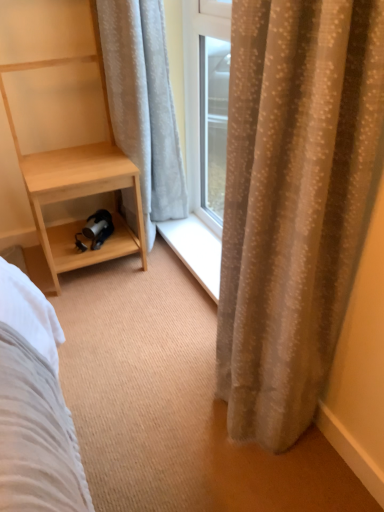
Describe the element at coordinates (294, 202) in the screenshot. The image size is (384, 512). I see `beige textured curtain at right, positioned as the 1th curtain in right-to-left order` at that location.

In order to face light wood/texture shelf at left, should I rotate leftwards or rightwards?

A 15.988 degree turn to the left will do.

What is the approximate width of light wood/texture shelf at left?

17.54 inches.

How much space does white textured curtain at left, the 2th curtain when ordered from right to left, occupy horizontally?

The width of white textured curtain at left, the 2th curtain when ordered from right to left, is 7.62 inches.

Describe the element at coordinates (143, 104) in the screenshot. I see `white textured curtain at left, the 2th curtain when ordered from right to left` at that location.

Where is `beige textured curtain at right, positioned as the 1th curtain in front-to-back order`? The image size is (384, 512). beige textured curtain at right, positioned as the 1th curtain in front-to-back order is located at coordinates (294, 202).

Considering the positions of point (101, 3) and point (75, 186), is point (101, 3) closer or farther from the camera than point (75, 186)?

Point (101, 3) is positioned farther from the camera compared to point (75, 186).

Between white textured curtain at left, the 2th curtain when ordered from right to left, and light wood/texture shelf at left, which one appears on the left side from the viewer's perspective?

From the viewer's perspective, light wood/texture shelf at left appears more on the left side.

Identify the location of shelf below the white textured curtain at left, the 1th curtain when ordered from left to right (from a real-world perspective). The width and height of the screenshot is (384, 512). (62, 136).

Is light wood/texture shelf at left next to white textured curtain at left, the 2th curtain when ordered from right to left?

No, light wood/texture shelf at left is not touching white textured curtain at left, the 2th curtain when ordered from right to left.

At what (x,y) coordinates should I click in order to perform the action: click on curtain behind the light wood/texture shelf at left. Please return your answer as a coordinate pair (x, y). The width and height of the screenshot is (384, 512). Looking at the image, I should click on (143, 104).

Can you tell me how much light wood/texture shelf at left and white textured curtain at left, marked as the first curtain in a back-to-front arrangement, differ in facing direction?

The angular difference between light wood/texture shelf at left and white textured curtain at left, marked as the first curtain in a back-to-front arrangement, is 88 degrees.

Considering the sizes of objects light wood/texture shelf at left and white textured curtain at left, the 2th curtain when ordered from right to left, in the image provided, who is wider, light wood/texture shelf at left or white textured curtain at left, the 2th curtain when ordered from right to left,?

Wider between the two is light wood/texture shelf at left.

From the image's perspective, is white textured curtain at left, acting as the 2th curtain starting from the front, on beige textured curtain at right, positioned as the 1th curtain in right-to-left order?

Indeed, from the image's perspective, white textured curtain at left, acting as the 2th curtain starting from the front, is shown above beige textured curtain at right, positioned as the 1th curtain in right-to-left order.

You are a GUI agent. You are given a task and a screenshot of the screen. Output one action in this format:
    pyautogui.click(x=<x>, y=<y>)
    Task: Click on the curtain that appears in front of the white textured curtain at left, the 1th curtain when ordered from left to right
    This screenshot has width=384, height=512.
    Given the screenshot: What is the action you would take?
    pyautogui.click(x=294, y=202)

Can you confirm if white textured curtain at left, acting as the 2th curtain starting from the front, is bigger than beige textured curtain at right, which is counted as the second curtain, starting from the back?

No.

Is the surface of beige textured curtain at right, positioned as the 1th curtain in right-to-left order, in direct contact with light wood/texture shelf at left?

They are not placed beside each other.

How different are the orientations of beige textured curtain at right, positioned as the 1th curtain in front-to-back order, and light wood/texture shelf at left in degrees?

The angle between the facing direction of beige textured curtain at right, positioned as the 1th curtain in front-to-back order, and the facing direction of light wood/texture shelf at left is 88 degrees.

Who is more distant, beige textured curtain at right, positioned as the 1th curtain in right-to-left order, or light wood/texture shelf at left?

light wood/texture shelf at left is more distant.

Looking at the image, does beige textured curtain at right, positioned as the 1th curtain in front-to-back order, seem bigger or smaller compared to light wood/texture shelf at left?

In the image, beige textured curtain at right, positioned as the 1th curtain in front-to-back order, appears to be smaller than light wood/texture shelf at left.

Is light wood/texture shelf at left facing away from beige textured curtain at right, acting as the 2th curtain starting from the left?

No.

At what (x,y) coordinates should I click in order to perform the action: click on shelf beneath the beige textured curtain at right, acting as the 2th curtain starting from the left (from a real-world perspective). Please return your answer as a coordinate pair (x, y). Looking at the image, I should click on pyautogui.click(x=62, y=136).

Which point is more distant from viewer, (92, 203) or (302, 9)?

Point (92, 203)

Who is smaller, beige textured curtain at right, positioned as the 1th curtain in front-to-back order, or white textured curtain at left, acting as the 2th curtain starting from the front?

With smaller size is white textured curtain at left, acting as the 2th curtain starting from the front.

The height and width of the screenshot is (512, 384). Identify the location of curtain lying above the beige textured curtain at right, which is counted as the second curtain, starting from the back (from the image's perspective). (143, 104).

Is there a large distance between beige textured curtain at right, acting as the 2th curtain starting from the left, and white textured curtain at left, acting as the 2th curtain starting from the front?

No, beige textured curtain at right, acting as the 2th curtain starting from the left, is not far from white textured curtain at left, acting as the 2th curtain starting from the front.

Would you say beige textured curtain at right, acting as the 2th curtain starting from the left, is inside or outside white textured curtain at left, the 1th curtain when ordered from left to right?

beige textured curtain at right, acting as the 2th curtain starting from the left, lies outside white textured curtain at left, the 1th curtain when ordered from left to right.

In the image, there is a white textured curtain at left, the 1th curtain when ordered from left to right. At what (x,y) coordinates should I click in order to perform the action: click on shelf below it (from a real-world perspective). Please return your answer as a coordinate pair (x, y). Image resolution: width=384 pixels, height=512 pixels. Looking at the image, I should click on 62,136.

At what (x,y) coordinates should I click in order to perform the action: click on shelf below the white textured curtain at left, the 2th curtain when ordered from right to left (from the image's perspective). Please return your answer as a coordinate pair (x, y). Looking at the image, I should click on (62, 136).

Which object lies nearer to the anchor point beige textured curtain at right, which is counted as the second curtain, starting from the back, light wood/texture shelf at left or white textured curtain at left, acting as the 2th curtain starting from the front?

Based on the image, white textured curtain at left, acting as the 2th curtain starting from the front, appears to be nearer to beige textured curtain at right, which is counted as the second curtain, starting from the back.

When comparing their distances from white textured curtain at left, the 2th curtain when ordered from right to left, does light wood/texture shelf at left or beige textured curtain at right, positioned as the 1th curtain in front-to-back order, seem further?

beige textured curtain at right, positioned as the 1th curtain in front-to-back order, is further to white textured curtain at left, the 2th curtain when ordered from right to left.

Which object lies further to the anchor point light wood/texture shelf at left, beige textured curtain at right, positioned as the 1th curtain in right-to-left order, or white textured curtain at left, marked as the first curtain in a back-to-front arrangement?

Based on the image, beige textured curtain at right, positioned as the 1th curtain in right-to-left order, appears to be further to light wood/texture shelf at left.

From the image, which object appears to be farther from beige textured curtain at right, positioned as the 1th curtain in right-to-left order, white textured curtain at left, the 2th curtain when ordered from right to left, or light wood/texture shelf at left?

Based on the image, light wood/texture shelf at left appears to be further to beige textured curtain at right, positioned as the 1th curtain in right-to-left order.

From the image, which object appears to be nearer to light wood/texture shelf at left, white textured curtain at left, marked as the first curtain in a back-to-front arrangement, or beige textured curtain at right, acting as the 2th curtain starting from the left?

white textured curtain at left, marked as the first curtain in a back-to-front arrangement, is closer to light wood/texture shelf at left.

Based on the photo, looking at the image, which one is located closer to white textured curtain at left, marked as the first curtain in a back-to-front arrangement, beige textured curtain at right, acting as the 2th curtain starting from the left, or light wood/texture shelf at left?

light wood/texture shelf at left is positioned closer to the anchor white textured curtain at left, marked as the first curtain in a back-to-front arrangement.

Identify the location of shelf positioned between beige textured curtain at right, positioned as the 1th curtain in right-to-left order, and white textured curtain at left, marked as the first curtain in a back-to-front arrangement, from near to far. The height and width of the screenshot is (512, 384). (62, 136).